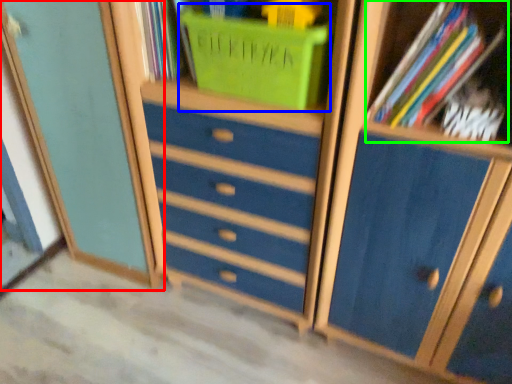
Question: Which is farther away from cupboard (highlighted by a red box)? basket (highlighted by a blue box) or book (highlighted by a green box)?

Choices:
 (A) basket
 (B) book

Answer: (B)